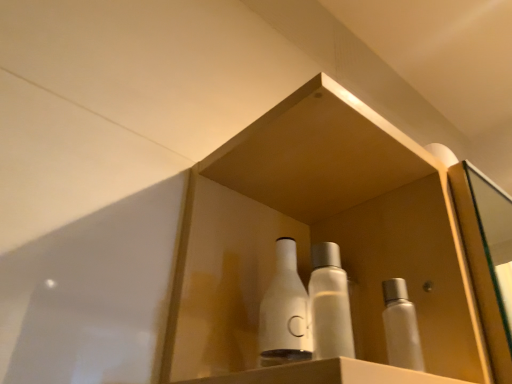
Describe the element at coordinates (284, 312) in the screenshot. The width and height of the screenshot is (512, 384). I see `white matte bottle at center, acting as the 1th bottle starting from the left` at that location.

You are a GUI agent. You are given a task and a screenshot of the screen. Output one action in this format:
    pyautogui.click(x=<x>, y=<y>)
    Task: Click on the white glossy bottles at center
    
    Given the screenshot: What is the action you would take?
    pyautogui.click(x=320, y=235)

From the image's perspective, would you say white matte bottle at center, acting as the 1th bottle starting from the left, is shown under white glossy bottles at center?

Indeed, from the image's perspective, white matte bottle at center, acting as the 1th bottle starting from the left, is shown beneath white glossy bottles at center.

Is white matte bottle at center, the third bottle positioned from the right, facing towards white glossy bottles at center?

Yes, white matte bottle at center, the third bottle positioned from the right, is aimed at white glossy bottles at center.

Considering their positions, is white matte bottle at center, acting as the 1th bottle starting from the left, located in front of or behind white glossy bottles at center?

white matte bottle at center, acting as the 1th bottle starting from the left, is positioned farther from the viewer than white glossy bottles at center.

Which point is more forward, [278,283] or [234,255]?

The point [278,283] is closer to the camera.

Measure the distance between white glossy bottles at center and white matte bottle at right, which appears as the first bottle when viewed from the right.

The distance of white glossy bottles at center from white matte bottle at right, which appears as the first bottle when viewed from the right, is 4.66 inches.

Which object is thinner, white glossy bottles at center or white matte bottle at right, which is the 3th bottle from left to right?

Thinner between the two is white matte bottle at right, which is the 3th bottle from left to right.

How many degrees apart are the facing directions of white glossy bottles at center and white matte bottle at right, which is the 3th bottle from left to right?

40.8 degrees.

Would you say white glossy bottles at center is a long distance from white matte bottle at right, which appears as the first bottle when viewed from the right?

No, white glossy bottles at center is in close proximity to white matte bottle at right, which appears as the first bottle when viewed from the right.

What's the angular difference between translucent plastic bottle at center, the second bottle viewed from the left, and white matte bottle at center, acting as the 1th bottle starting from the left,'s facing directions?

There is a 19.2-degree angle between the facing directions of translucent plastic bottle at center, the second bottle viewed from the left, and white matte bottle at center, acting as the 1th bottle starting from the left.

Which is more to the right, translucent plastic bottle at center, the second bottle viewed from the left, or white matte bottle at center, acting as the 1th bottle starting from the left?

translucent plastic bottle at center, the second bottle viewed from the left.

From the image's perspective, is translucent plastic bottle at center, the second bottle positioned from the right, positioned above or below white matte bottle at center, acting as the 1th bottle starting from the left?

From the image's perspective, translucent plastic bottle at center, the second bottle positioned from the right, appears above white matte bottle at center, acting as the 1th bottle starting from the left.

Is point (339, 347) in front of point (301, 309)?

Yes.

In the scene shown: From a real-world perspective, between white glossy bottles at center and translucent plastic bottle at center, the second bottle positioned from the right, who is vertically higher?

white glossy bottles at center.

Can you confirm if white glossy bottles at center is smaller than translucent plastic bottle at center, the second bottle viewed from the left?

No, white glossy bottles at center is not smaller than translucent plastic bottle at center, the second bottle viewed from the left.

Considering the positions of objects white glossy bottles at center and translucent plastic bottle at center, the second bottle viewed from the left, in the image provided, who is in front, white glossy bottles at center or translucent plastic bottle at center, the second bottle viewed from the left,?

white glossy bottles at center.

How different are the orientations of white glossy bottles at center and translucent plastic bottle at center, the second bottle viewed from the left, in degrees?

The angular difference between white glossy bottles at center and translucent plastic bottle at center, the second bottle viewed from the left, is 21.7 degrees.

From the image's perspective, is white glossy bottles at center positioned above or below white matte bottle at center, acting as the 1th bottle starting from the left?

Clearly, from the image's perspective, white glossy bottles at center is above white matte bottle at center, acting as the 1th bottle starting from the left.

Is white glossy bottles at center situated inside white matte bottle at center, acting as the 1th bottle starting from the left, or outside?

white glossy bottles at center is outside white matte bottle at center, acting as the 1th bottle starting from the left.

Is white glossy bottles at center bigger than white matte bottle at center, acting as the 1th bottle starting from the left?

Indeed, white glossy bottles at center has a larger size compared to white matte bottle at center, acting as the 1th bottle starting from the left.

Is the position of white matte bottle at center, acting as the 1th bottle starting from the left, more distant than that of white matte bottle at right, which is the 3th bottle from left to right?

Yes, it is.

Can you confirm if white matte bottle at center, the third bottle positioned from the right, is thinner than white matte bottle at right, which is the 3th bottle from left to right?

No, white matte bottle at center, the third bottle positioned from the right, is not thinner than white matte bottle at right, which is the 3th bottle from left to right.

Considering the positions of point (281, 352) and point (408, 343), is point (281, 352) closer or farther from the camera than point (408, 343)?

Clearly, point (281, 352) is closer to the camera than point (408, 343).

Is white matte bottle at right, which appears as the first bottle when viewed from the right, located within white matte bottle at center, acting as the 1th bottle starting from the left?

Definitely not — white matte bottle at right, which appears as the first bottle when viewed from the right, is not inside white matte bottle at center, acting as the 1th bottle starting from the left.

Is white matte bottle at right, which is the 3th bottle from left to right, positioned before white glossy bottles at center?

No, white matte bottle at right, which is the 3th bottle from left to right, is further to the viewer.

Would you say white matte bottle at right, which appears as the first bottle when viewed from the right, is inside or outside white glossy bottles at center?

The correct answer is: inside.

Is white matte bottle at right, which is the 3th bottle from left to right, oriented towards white glossy bottles at center?

A: Yes, white matte bottle at right, which is the 3th bottle from left to right, is facing white glossy bottles at center.

Considering the sizes of white matte bottle at right, which appears as the first bottle when viewed from the right, and white glossy bottles at center in the image, is white matte bottle at right, which appears as the first bottle when viewed from the right, wider or thinner than white glossy bottles at center?

Clearly, white matte bottle at right, which appears as the first bottle when viewed from the right, has less width compared to white glossy bottles at center.

At what (x,y) coordinates should I click in order to perform the action: click on shelf that appears in front of the white matte bottle at center, the third bottle positioned from the right. Please return your answer as a coordinate pair (x, y). The width and height of the screenshot is (512, 384). Looking at the image, I should click on (320, 235).

At what (x,y) coordinates should I click in order to perform the action: click on shelf on the left of white matte bottle at right, which is the 3th bottle from left to right. Please return your answer as a coordinate pair (x, y). The height and width of the screenshot is (384, 512). Looking at the image, I should click on (320, 235).

Looking at the image, which one is located further to white matte bottle at center, the third bottle positioned from the right, white glossy bottles at center or translucent plastic bottle at center, the second bottle viewed from the left?

white glossy bottles at center is further to white matte bottle at center, the third bottle positioned from the right.

Estimate the real-world distances between objects in this image. Which object is further from white glossy bottles at center, white matte bottle at center, the third bottle positioned from the right, or translucent plastic bottle at center, the second bottle viewed from the left?

translucent plastic bottle at center, the second bottle viewed from the left, is further to white glossy bottles at center.

Considering their positions, is translucent plastic bottle at center, the second bottle viewed from the left, positioned closer to white matte bottle at right, which is the 3th bottle from left to right, than white glossy bottles at center?

translucent plastic bottle at center, the second bottle viewed from the left, is positioned closer to the anchor white matte bottle at right, which is the 3th bottle from left to right.

When comparing their distances from translucent plastic bottle at center, the second bottle positioned from the right, does white matte bottle at center, the third bottle positioned from the right, or white matte bottle at right, which is the 3th bottle from left to right, seem further?

white matte bottle at right, which is the 3th bottle from left to right.

From the image, which object appears to be farther from white matte bottle at center, acting as the 1th bottle starting from the left, white matte bottle at right, which is the 3th bottle from left to right, or translucent plastic bottle at center, the second bottle positioned from the right?

Based on the image, white matte bottle at right, which is the 3th bottle from left to right, appears to be further to white matte bottle at center, acting as the 1th bottle starting from the left.

Which object lies nearer to the anchor point white matte bottle at center, acting as the 1th bottle starting from the left, translucent plastic bottle at center, the second bottle positioned from the right, or white glossy bottles at center?

The object closer to white matte bottle at center, acting as the 1th bottle starting from the left, is translucent plastic bottle at center, the second bottle positioned from the right.

Which object lies nearer to the anchor point translucent plastic bottle at center, the second bottle viewed from the left, white glossy bottles at center or white matte bottle at center, acting as the 1th bottle starting from the left?

white matte bottle at center, acting as the 1th bottle starting from the left, is closer to translucent plastic bottle at center, the second bottle viewed from the left.

From the image, which object appears to be farther from white matte bottle at right, which is the 3th bottle from left to right, white glossy bottles at center or translucent plastic bottle at center, the second bottle positioned from the right?

white glossy bottles at center lies further to white matte bottle at right, which is the 3th bottle from left to right, than the other object.

Identify the location of shelf between translucent plastic bottle at center, the second bottle positioned from the right, and white matte bottle at right, which appears as the first bottle when viewed from the right, from left to right. The image size is (512, 384). (320, 235).

Identify the location of shelf between white matte bottle at center, the third bottle positioned from the right, and white matte bottle at right, which is the 3th bottle from left to right. The height and width of the screenshot is (384, 512). (320, 235).

This screenshot has height=384, width=512. What are the coordinates of `bottle between white matte bottle at center, acting as the 1th bottle starting from the left, and white matte bottle at right, which is the 3th bottle from left to right, in the horizontal direction` in the screenshot? It's located at (329, 304).